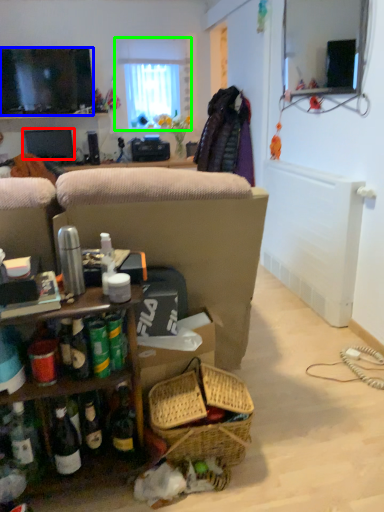
Question: Based on their relative distances, which object is farther from television (highlighted by a red box)? Choose from television (highlighted by a blue box) and window (highlighted by a green box).

Choices:
 (A) television
 (B) window

Answer: (B)